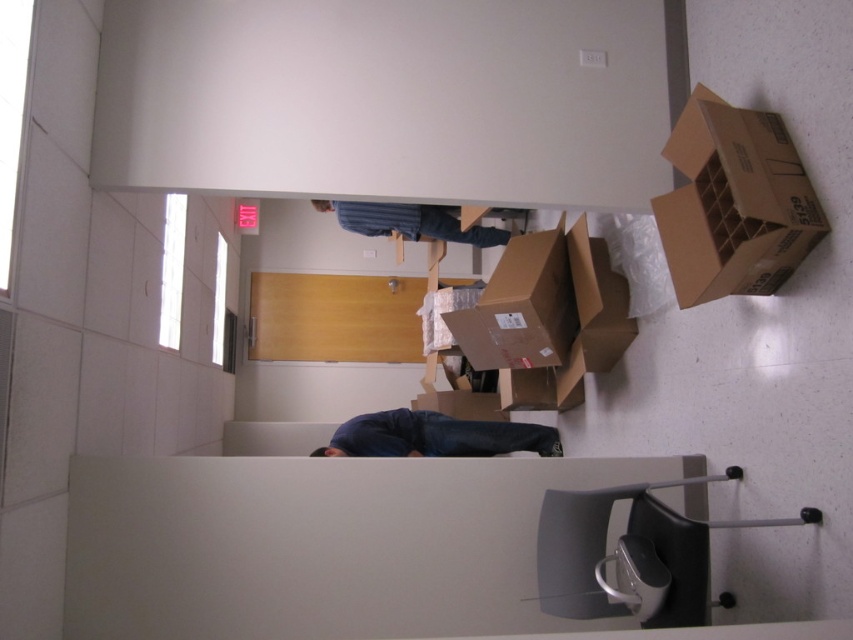
Is brown cardboard box at upper right to the right of blue jeans at lower center from the viewer's perspective?

Yes, brown cardboard box at upper right is to the right of blue jeans at lower center.

Does brown cardboard box at upper right have a larger size compared to blue jeans at lower center?

Actually, brown cardboard box at upper right might be smaller than blue jeans at lower center.

Does point (670, 154) come in front of point (384, 417)?

Yes, point (670, 154) is in front of point (384, 417).

Identify the location of brown cardboard box at upper right. The width and height of the screenshot is (853, 640). coord(734,202).

Is brown cardboard box at center shorter than blue denim jeans at upper center?

No.

Is point (546, 344) positioned before point (346, 227)?

Yes, it is.

Find the location of `brown cardboard box at center`. brown cardboard box at center is located at coordinates (521, 307).

Does brown cardboard box at upper right have a greater width compared to blue denim jeans at upper center?

No, brown cardboard box at upper right is not wider than blue denim jeans at upper center.

Can you confirm if brown cardboard box at upper right is thinner than blue denim jeans at upper center?

Correct, brown cardboard box at upper right's width is less than blue denim jeans at upper center's.

Does point (677, 120) come behind point (323, 202)?

No, it is not.

The width and height of the screenshot is (853, 640). I want to click on brown cardboard box at upper right, so click(x=734, y=202).